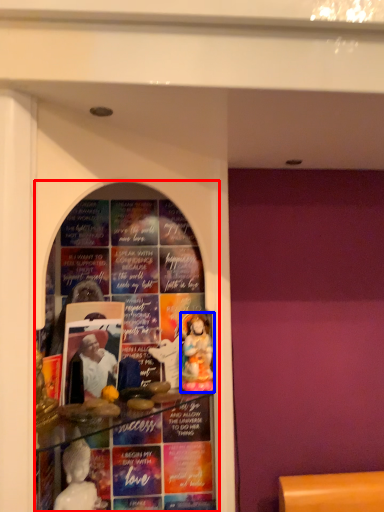
Question: Which of the following is the closest to the observer, shop window (highlighted by a red box) or person (highlighted by a blue box)?

Choices:
 (A) shop window
 (B) person

Answer: (A)